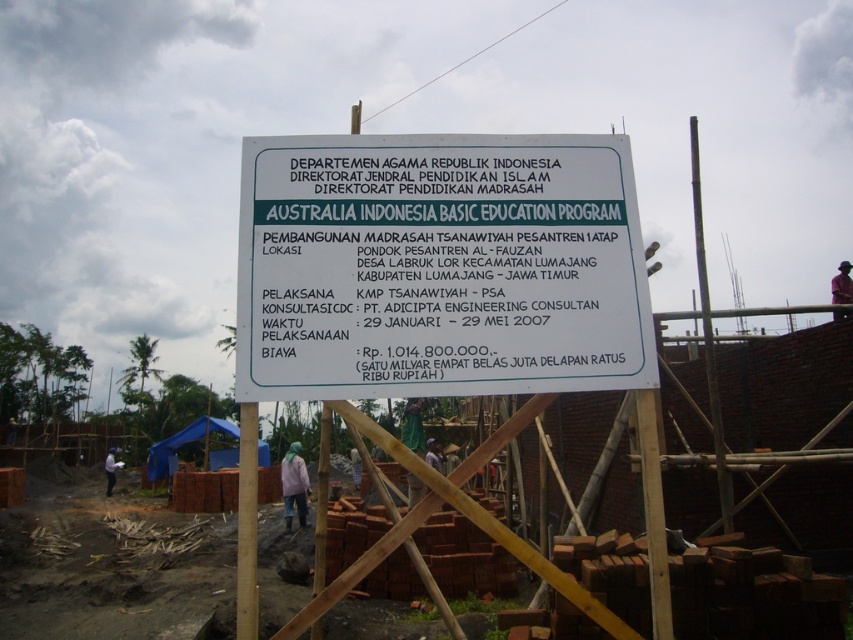
Question: Among these objects, which one is farthest from the camera?

Choices:
 (A) white plastic sign at center
 (B) white wooden sign at center
 (C) pink fabric at center

Answer: (C)

Question: Is white plastic sign at center above white wooden sign at center?

Choices:
 (A) yes
 (B) no

Answer: (A)

Question: Does white wooden sign at center appear under pink fabric at center?

Choices:
 (A) no
 (B) yes

Answer: (B)

Question: Among these objects, which one is nearest to the camera?

Choices:
 (A) white plastic sign at center
 (B) pink fabric at center
 (C) white wooden sign at center

Answer: (A)

Question: Does white plastic sign at center come in front of white wooden sign at center?

Choices:
 (A) no
 (B) yes

Answer: (B)

Question: Among these points, which one is nearest to the camera?

Choices:
 (A) (281, 180)
 (B) (308, 490)
 (C) (689, 442)

Answer: (A)